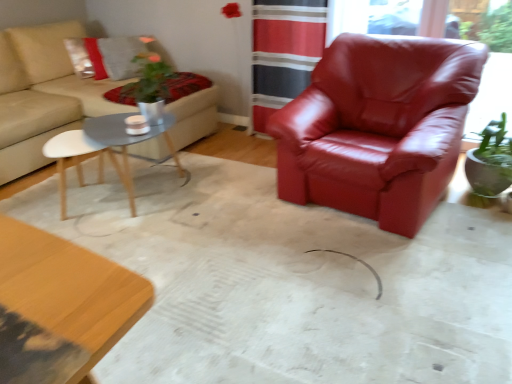
Locate an element on the screen. This screenshot has width=512, height=384. free area in between matte gray wood coffee table at center-left and satin red armchair at center is located at coordinates (241, 211).